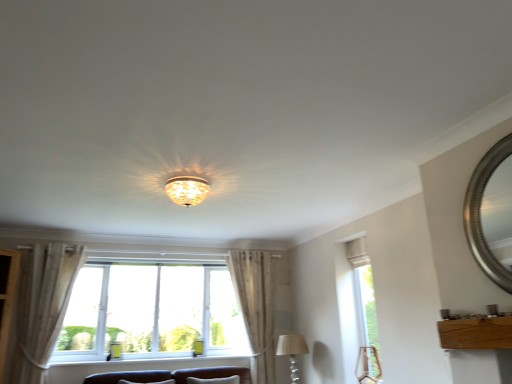
Question: From a real-world perspective, is silver metallic mirror at upper right above or below translucent glass chandelier at center, arranged as the 2th lamp when ordered from the bottom?

Choices:
 (A) below
 (B) above

Answer: (A)

Question: Is silver metallic mirror at upper right to the left or to the right of translucent glass chandelier at center, the 1th lamp from the left, in the image?

Choices:
 (A) right
 (B) left

Answer: (A)

Question: Considering the real-world distances, which object is closest to the white painted wood at lower center?

Choices:
 (A) white sheer curtain at center, which is counted as the second curtain, starting from the left
 (B) silver metallic mirror at upper right
 (C) wooden board at lower right
 (D) white plastic window at center, arranged as the first window when viewed from the left
 (E) beige fabric lampshade at lower center, the first lamp in the back-to-front sequence

Answer: (D)

Question: Which is farther from the clear glass window at right, which is the 2th window in left-to-right order?

Choices:
 (A) white sheer curtain at center, the 2th curtain when ordered from front to back
 (B) silver metallic mirror at upper right
 (C) wooden board at lower right
 (D) beige fabric lampshade at lower center, marked as the 2th lamp in a left-to-right arrangement
 (E) light beige fabric curtain at left, marked as the first curtain in a front-to-back arrangement

Answer: (E)